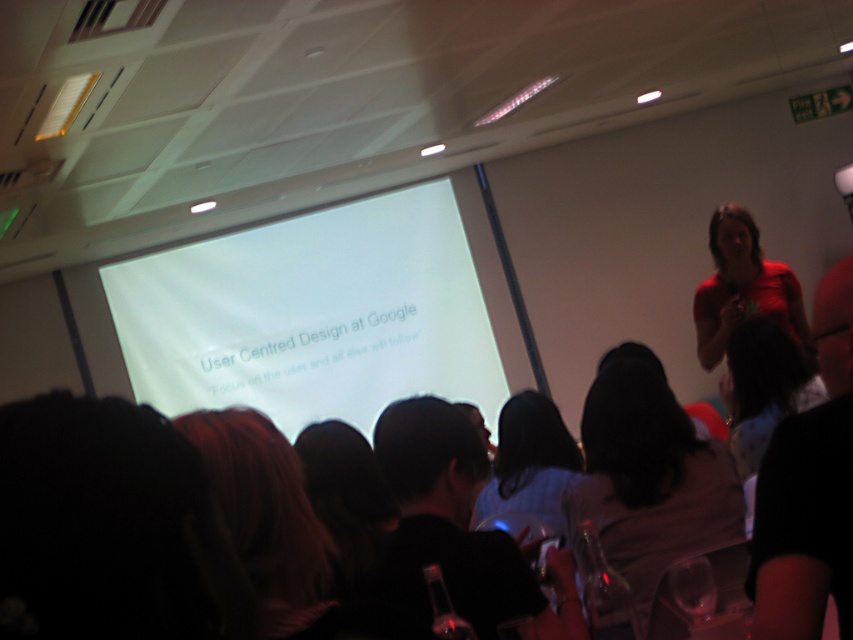
Question: Can you confirm if white matte projection screen at center is positioned to the left of dark brown hair at lower left?

Choices:
 (A) yes
 (B) no

Answer: (A)

Question: Which of the following is the farthest from the observer?

Choices:
 (A) transparent plastic wine glass at lower right
 (B) red matte shirt at upper right

Answer: (B)

Question: Is white matte projection screen at center wider than red matte shirt at upper right?

Choices:
 (A) yes
 (B) no

Answer: (A)

Question: Does silky black hair at center have a greater width compared to transparent plastic wine glass at lower right?

Choices:
 (A) no
 (B) yes

Answer: (B)

Question: Which object is positioned farthest from the red matte shirt at upper right?

Choices:
 (A) transparent plastic wine glass at lower right
 (B) light blue shirt at center
 (C) silky black hair at center

Answer: (A)

Question: Which point is farther to the camera?

Choices:
 (A) (688, 609)
 (B) (312, 289)
 (C) (300, 522)
 (D) (651, 547)

Answer: (B)